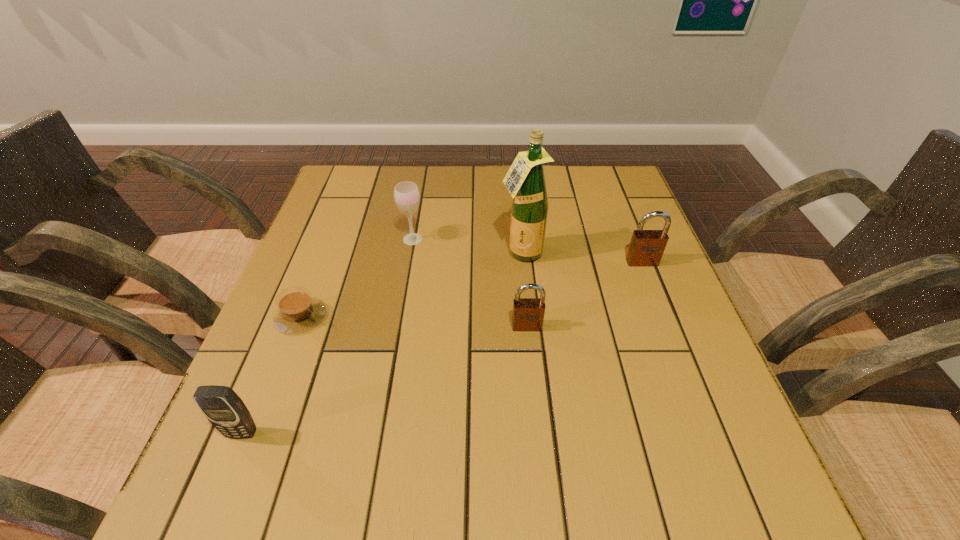
Please point a vacant point for placing a padlock on the left. Please provide its 2D coordinates. Your answer should be formatted as a tuple, i.e. [(x, y)], where the tuple contains the x and y coordinates of a point satisfying the conditions above.

[(370, 415)]